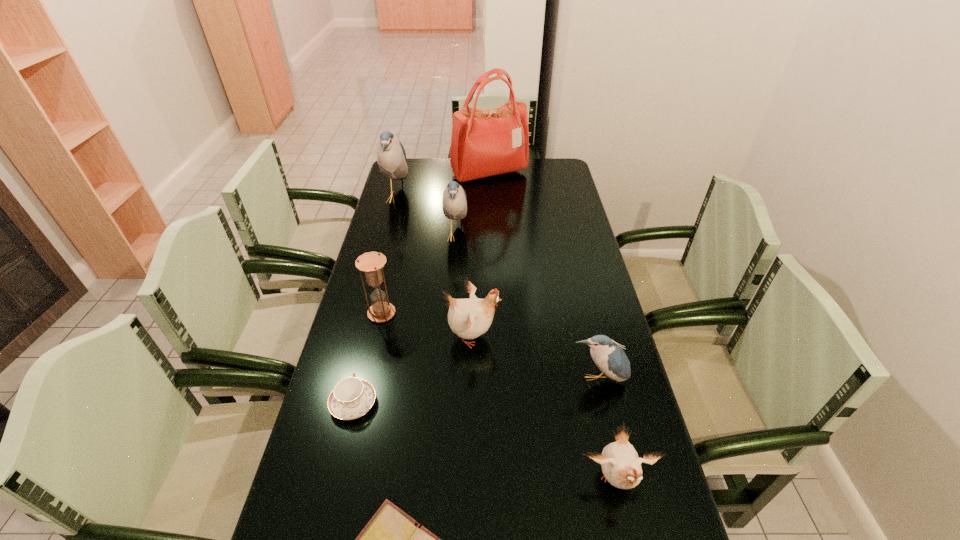
The height and width of the screenshot is (540, 960). In order to click on the nearest blue bird in this screenshot , I will do `click(609, 357)`.

You are a GUI agent. You are given a task and a screenshot of the screen. Output one action in this format:
    pyautogui.click(x=<x>, y=<y>)
    Task: Click on the nearest bird
    
    Given the screenshot: What is the action you would take?
    pyautogui.click(x=621, y=466)

You are a GUI agent. You are given a task and a screenshot of the screen. Output one action in this format:
    pyautogui.click(x=<x>, y=<y>)
    Task: Click on the smaller white bird
    
    Given the screenshot: What is the action you would take?
    pyautogui.click(x=621, y=466)

At what (x,y) coordinates should I click in order to perform the action: click on blue teacup. Please return your answer as a coordinate pair (x, y). Looking at the image, I should click on (351, 398).

In order to click on teacup in this screenshot , I will do `click(351, 398)`.

The height and width of the screenshot is (540, 960). I want to click on free space located 0.230m on the front-facing side of the handbag, so click(x=491, y=218).

Find the location of `vacant space located 0.350m at the tip of the eighth shortest object's beak`. vacant space located 0.350m at the tip of the eighth shortest object's beak is located at coordinates (494, 198).

Identify the location of free region located 0.170m at the tip of the second tallest bird's beak. (514, 236).

What are the coordinates of `vacant space situated on the back of the hourglass` in the screenshot? It's located at (399, 234).

Locate an element on the screen. The image size is (960, 540). free space located at the beak of the left white bird is located at coordinates (524, 336).